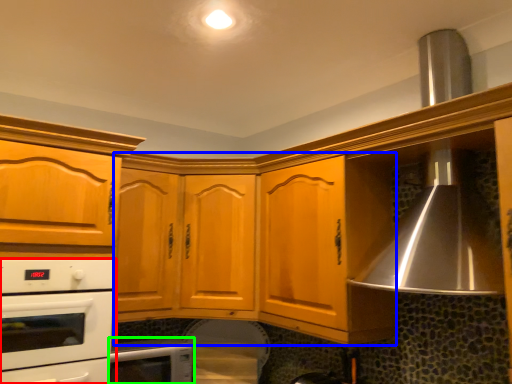
Question: Considering the real-world distances, which object is farthest from home appliance (highlighted by a red box)? cabinetry (highlighted by a blue box) or home appliance (highlighted by a green box)?

Choices:
 (A) cabinetry
 (B) home appliance

Answer: (A)